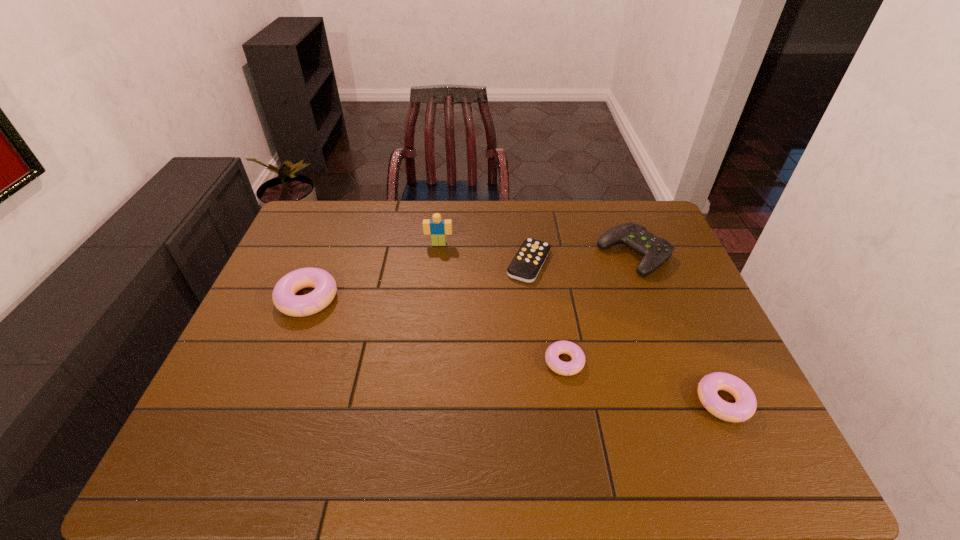
Locate an element on the screen. The height and width of the screenshot is (540, 960). the tallest doughnut is located at coordinates (284, 298).

The width and height of the screenshot is (960, 540). What are the coordinates of `the farthest doughnut` in the screenshot? It's located at 284,298.

The image size is (960, 540). What are the coordinates of `the second doughnut from left to right` in the screenshot? It's located at (577, 363).

The height and width of the screenshot is (540, 960). Find the location of `the fourth tallest object`. the fourth tallest object is located at coordinates (745, 406).

Find the location of `the second shortest doughnut`. the second shortest doughnut is located at coordinates (745, 406).

This screenshot has height=540, width=960. Find the location of `control`. control is located at coordinates (655, 250).

Locate an element on the screen. This screenshot has width=960, height=540. remote control is located at coordinates (528, 261).

The height and width of the screenshot is (540, 960). I want to click on the tallest object, so click(438, 228).

Locate an element on the screen. the second object from left to right is located at coordinates coord(438,228).

I want to click on vacant region located on the right of the leftmost doughnut, so click(x=460, y=298).